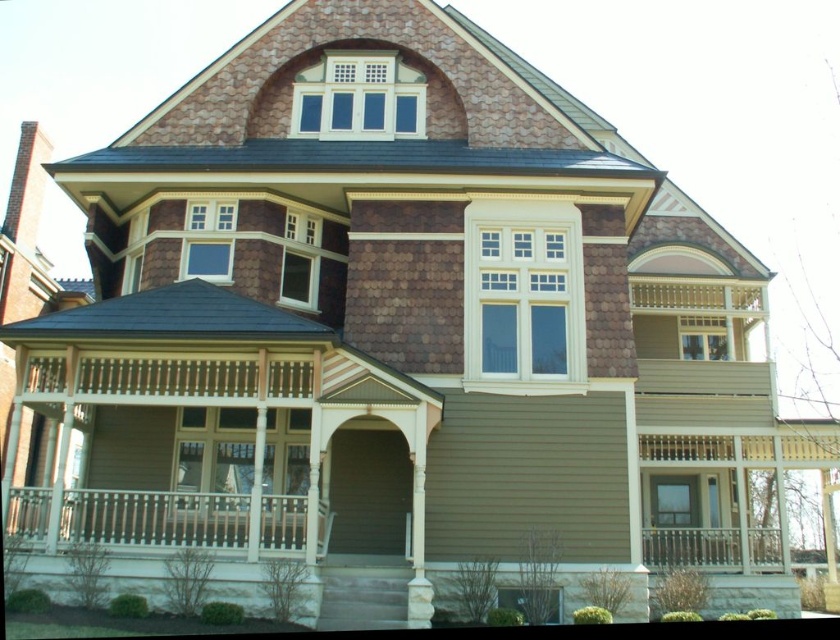
Does white wooden balustrade at lower left have a smaller size compared to white painted wood balustrade at lower right?

Indeed, white wooden balustrade at lower left has a smaller size compared to white painted wood balustrade at lower right.

Is point (242, 540) farther from viewer compared to point (772, 554)?

No, (242, 540) is in front of (772, 554).

I want to click on white wooden balustrade at lower left, so click(156, 518).